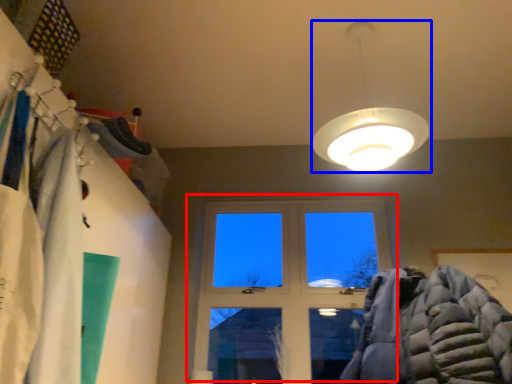
Question: Which of the following is the closest to the observer, window (highlighted by a red box) or lamp (highlighted by a blue box)?

Choices:
 (A) window
 (B) lamp

Answer: (B)